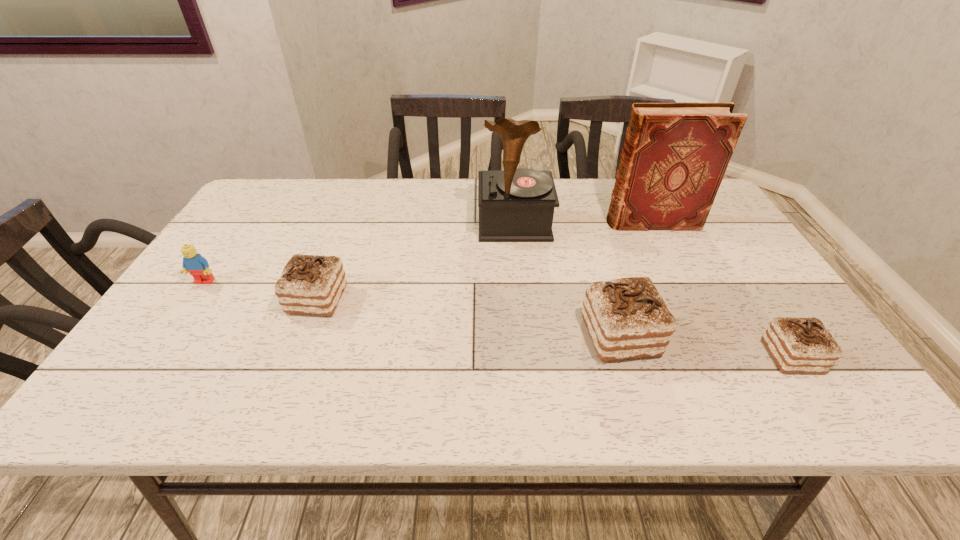
The height and width of the screenshot is (540, 960). What are the coordinates of `vacant space located 0.340m on the left of the rightmost chocolate cake` in the screenshot? It's located at (609, 357).

Locate an element on the screen. The height and width of the screenshot is (540, 960). vacant space located 0.210m at the horn opening of the phonograph_record is located at coordinates (521, 295).

Image resolution: width=960 pixels, height=540 pixels. In order to click on vacant space located 0.120m on the spine side of the hardback book in this screenshot , I will do `click(565, 222)`.

The height and width of the screenshot is (540, 960). I want to click on vacant space located on the spine side of the hardback book, so click(x=559, y=222).

Locate an element on the screen. Image resolution: width=960 pixels, height=540 pixels. vacant space located on the spine side of the hardback book is located at coordinates (492, 222).

Image resolution: width=960 pixels, height=540 pixels. I want to click on vacant space located on the face of the leftmost object, so click(163, 342).

Identify the location of phonograph_record located at the far edge. This screenshot has height=540, width=960. (515, 205).

What are the coordinates of `hardback book positioned at the far edge` in the screenshot? It's located at (675, 155).

The width and height of the screenshot is (960, 540). In order to click on object situated at the left edge in this screenshot , I will do `click(193, 262)`.

Where is `chocolate cake present at the right edge`? Image resolution: width=960 pixels, height=540 pixels. chocolate cake present at the right edge is located at coordinates (797, 345).